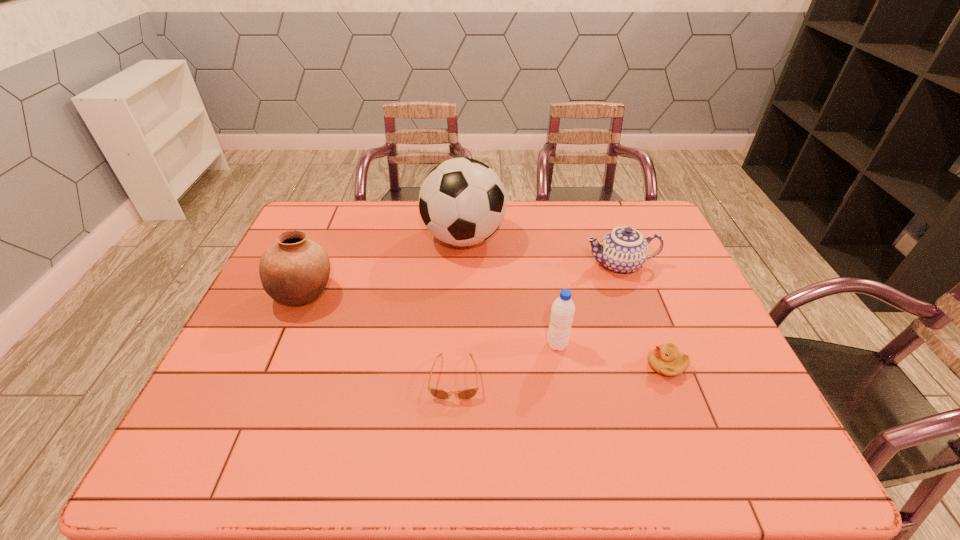
The width and height of the screenshot is (960, 540). I want to click on vacant point located from the spout of the third shortest object, so click(x=536, y=265).

In order to click on free space located from the spout of the third shortest object in this screenshot , I will do `click(513, 265)`.

Identify the location of vacant space located on the front-facing side of the second shortest object. Image resolution: width=960 pixels, height=540 pixels. (582, 366).

Locate an element on the screen. free location located on the front-facing side of the second shortest object is located at coordinates (607, 366).

The width and height of the screenshot is (960, 540). Find the location of `vacant space situated on the front-facing side of the second shortest object`. vacant space situated on the front-facing side of the second shortest object is located at coordinates (614, 366).

This screenshot has height=540, width=960. What are the coordinates of `vacant space located on the front-facing side of the sunglasses` in the screenshot? It's located at (450, 472).

Find the location of `object at the far edge`. object at the far edge is located at coordinates (462, 202).

Where is `object situated at the left edge`? object situated at the left edge is located at coordinates (295, 270).

Locate an element on the screen. chinaware that is positioned at the right edge is located at coordinates (623, 250).

Where is `duckling at the right edge`? This screenshot has width=960, height=540. duckling at the right edge is located at coordinates (666, 360).